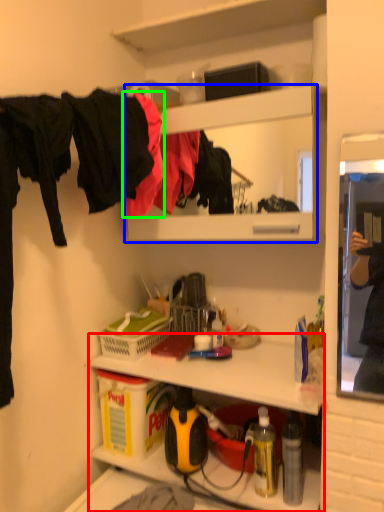
Question: Which object is positioned closest to shelf (highlighted by a red box)? Select from cabinet (highlighted by a blue box) and clothing (highlighted by a green box).

Choices:
 (A) cabinet
 (B) clothing

Answer: (B)